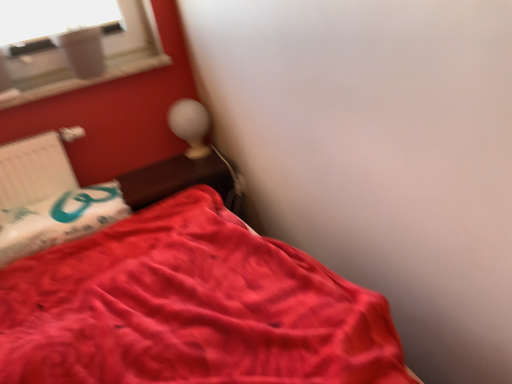
This screenshot has height=384, width=512. What do you see at coordinates (180, 180) in the screenshot?
I see `wooden table at upper center` at bounding box center [180, 180].

Image resolution: width=512 pixels, height=384 pixels. Describe the element at coordinates (168, 291) in the screenshot. I see `satin red bed at lower left` at that location.

At what (x,y) coordinates should I click in order to perform the action: click on satin red bed at lower left. Please return your answer as a coordinate pair (x, y). This screenshot has height=384, width=512. Looking at the image, I should click on (168, 291).

Locate an element on the screen. The height and width of the screenshot is (384, 512). white plastic radiator at left is located at coordinates (34, 170).

The image size is (512, 384). Identify the location of wooden table at upper center. (180, 180).

Does satin red bed at lower left touch wooden table at upper center?

No, satin red bed at lower left is not with wooden table at upper center.

Between satin red bed at lower left and wooden table at upper center, which one has more height?

satin red bed at lower left is taller.

This screenshot has height=384, width=512. I want to click on bed below the wooden table at upper center (from a real-world perspective), so click(x=168, y=291).

Does wooden table at upper center have a lesser height compared to matte white table lamp at upper center?

Yes, wooden table at upper center is shorter than matte white table lamp at upper center.

In terms of size, does wooden table at upper center appear bigger or smaller than matte white table lamp at upper center?

wooden table at upper center is bigger than matte white table lamp at upper center.

From a real-world perspective, is wooden table at upper center located beneath matte white table lamp at upper center?

Indeed, from a real-world perspective, wooden table at upper center is positioned beneath matte white table lamp at upper center.

Can you see wooden table at upper center touching matte white table lamp at upper center?

They are not placed beside each other.

Can you confirm if white plastic radiator at left is wider than matte white table lamp at upper center?

No.

What's the angular difference between white plastic radiator at left and matte white table lamp at upper center's facing directions?

They differ by 2.5 degrees in their facing directions.

Is point (1, 198) less distant than point (177, 117)?

Yes, it is.

Is there a large distance between white plastic radiator at left and matte white table lamp at upper center?

white plastic radiator at left is near matte white table lamp at upper center, not far away.

From a real-world perspective, is satin red bed at lower left positioned over matte white table lamp at upper center based on gravity?

Incorrect, from a real-world perspective, satin red bed at lower left is lower than matte white table lamp at upper center.

Is satin red bed at lower left oriented towards matte white table lamp at upper center?

No, satin red bed at lower left is not aimed at matte white table lamp at upper center.

Is satin red bed at lower left to the left of matte white table lamp at upper center from the viewer's perspective?

Indeed, satin red bed at lower left is positioned on the left side of matte white table lamp at upper center.

Which object is further away from the camera, satin red bed at lower left or matte white table lamp at upper center?

matte white table lamp at upper center is further away from the camera.

Can you tell me how much wooden table at upper center and white plastic radiator at left differ in facing direction?

They differ by 1.5 degrees in their facing directions.

Which object is closer to the camera, wooden table at upper center or white plastic radiator at left?

white plastic radiator at left is in front.

Is the surface of wooden table at upper center in direct contact with white plastic radiator at left?

They are not placed beside each other.

Is wooden table at upper center facing away from white plastic radiator at left?

That's not correct — wooden table at upper center is not looking away from white plastic radiator at left.

From the picture: Can you confirm if white plastic radiator at left is taller than satin red bed at lower left?

In fact, white plastic radiator at left may be shorter than satin red bed at lower left.

In terms of size, does white plastic radiator at left appear bigger or smaller than satin red bed at lower left?

Considering their sizes, white plastic radiator at left takes up less space than satin red bed at lower left.

Between white plastic radiator at left and satin red bed at lower left, which one is positioned in front?

satin red bed at lower left is in front.

From the picture: Could you tell me if white plastic radiator at left is turned towards satin red bed at lower left?

Yes, white plastic radiator at left is turned towards satin red bed at lower left.

Which is nearer, (170, 114) or (131, 301)?

Point (170, 114) is positioned farther from the camera compared to point (131, 301).

Considering the positions of objects matte white table lamp at upper center and satin red bed at lower left in the image provided, who is more to the left, matte white table lamp at upper center or satin red bed at lower left?

satin red bed at lower left is more to the left.

Find the location of a particular element. bed lying on the left of matte white table lamp at upper center is located at coordinates (168, 291).

Identify the location of table above the satin red bed at lower left (from the image's perspective). The width and height of the screenshot is (512, 384). (180, 180).

This screenshot has width=512, height=384. I want to click on table below the matte white table lamp at upper center (from a real-world perspective), so click(x=180, y=180).

Which object lies further to the anchor point wooden table at upper center, matte white table lamp at upper center or satin red bed at lower left?

Based on the image, satin red bed at lower left appears to be further to wooden table at upper center.

Looking at the image, which one is located closer to wooden table at upper center, white plastic radiator at left or satin red bed at lower left?

Based on the image, satin red bed at lower left appears to be nearer to wooden table at upper center.

Looking at the image, which one is located further to white plastic radiator at left, matte white table lamp at upper center or satin red bed at lower left?

Among the two, matte white table lamp at upper center is located further to white plastic radiator at left.

From the image, which object appears to be nearer to matte white table lamp at upper center, wooden table at upper center or satin red bed at lower left?

wooden table at upper center is closer to matte white table lamp at upper center.

Based on their spatial positions, is wooden table at upper center or white plastic radiator at left closer to satin red bed at lower left?

wooden table at upper center is positioned closer to the anchor satin red bed at lower left.

Estimate the real-world distances between objects in this image. Which object is further from wooden table at upper center, white plastic radiator at left or matte white table lamp at upper center?

white plastic radiator at left is further to wooden table at upper center.

Estimate the real-world distances between objects in this image. Which object is closer to matte white table lamp at upper center, white plastic radiator at left or satin red bed at lower left?

Based on the image, white plastic radiator at left appears to be nearer to matte white table lamp at upper center.

Considering their positions, is satin red bed at lower left positioned closer to white plastic radiator at left than wooden table at upper center?

Among the two, satin red bed at lower left is located nearer to white plastic radiator at left.

You are a GUI agent. You are given a task and a screenshot of the screen. Output one action in this format:
    pyautogui.click(x=<x>, y=<y>)
    Task: Click on the radiator between satin red bed at lower left and wooden table at upper center in the front-back direction
    
    Given the screenshot: What is the action you would take?
    pyautogui.click(x=34, y=170)

Locate an element on the screen. table between satin red bed at lower left and matte white table lamp at upper center in the front-back direction is located at coordinates [x=180, y=180].

At what (x,y) coordinates should I click in order to perform the action: click on radiator located between satin red bed at lower left and matte white table lamp at upper center in the depth direction. Please return your answer as a coordinate pair (x, y). Looking at the image, I should click on (34, 170).

Find the location of a particular element. This screenshot has height=384, width=512. table between white plastic radiator at left and matte white table lamp at upper center is located at coordinates (180, 180).